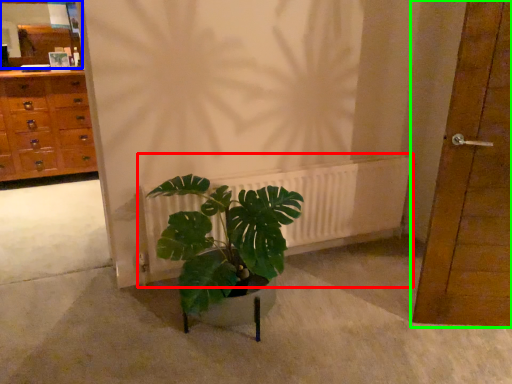
Question: Based on their relative distances, which object is farther from radiator (highlighted by a red box)? Choose from mirror (highlighted by a blue box) and door (highlighted by a green box).

Choices:
 (A) mirror
 (B) door

Answer: (A)